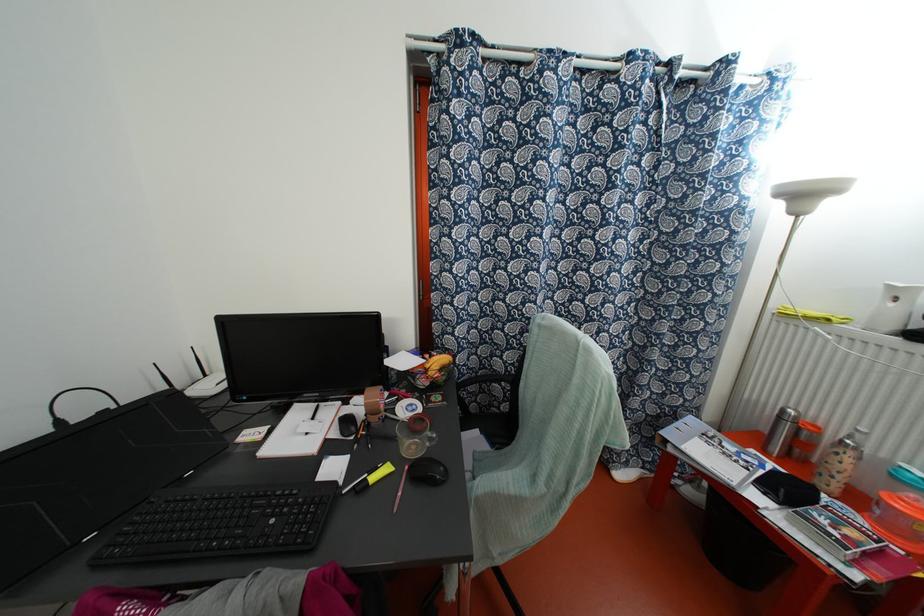
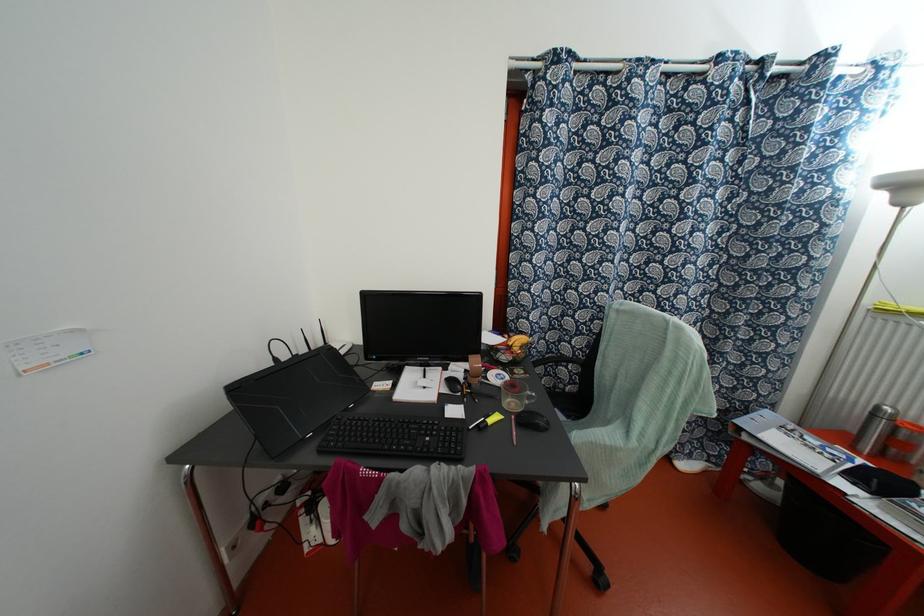
The point at (x=406, y=467) is marked in the first image. Where is the corresponding point in the second image?

(513, 416)